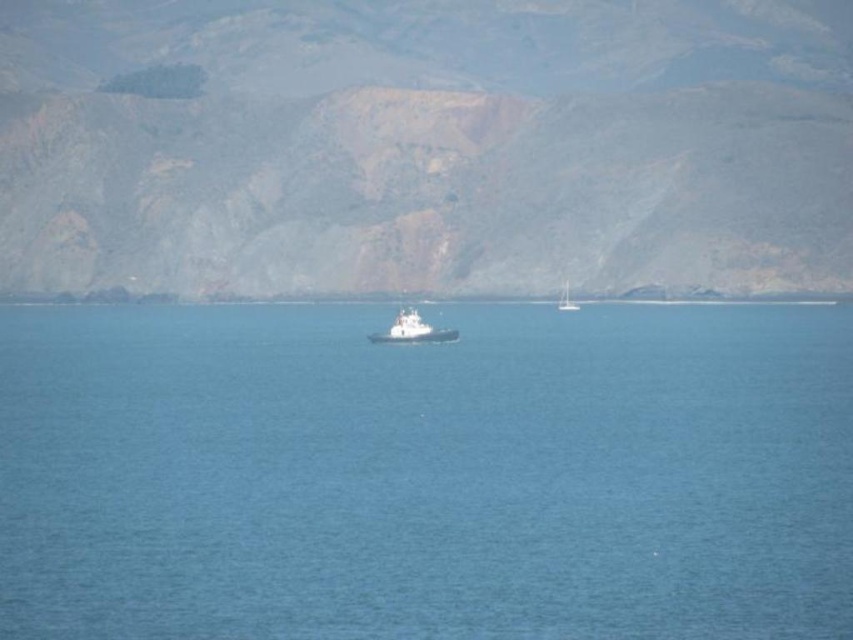
Question: Does blue water at center appear under brown rocky mountain at center?

Choices:
 (A) yes
 (B) no

Answer: (A)

Question: Is brown rocky mountain at center behind white matte boat at center?

Choices:
 (A) no
 (B) yes

Answer: (B)

Question: Does brown rocky mountain at center appear on the left side of white matte boat at center?

Choices:
 (A) no
 (B) yes

Answer: (A)

Question: Which object is closer to the camera taking this photo?

Choices:
 (A) white matte boat at center
 (B) blue water at center
 (C) brown rocky mountain at center
 (D) white plastic boat at center

Answer: (B)

Question: Among these objects, which one is nearest to the camera?

Choices:
 (A) brown rocky mountain at center
 (B) blue water at center

Answer: (B)

Question: Which object is positioned farthest from the blue water at center?

Choices:
 (A) brown rocky mountain at center
 (B) white plastic boat at center
 (C) white matte boat at center

Answer: (B)